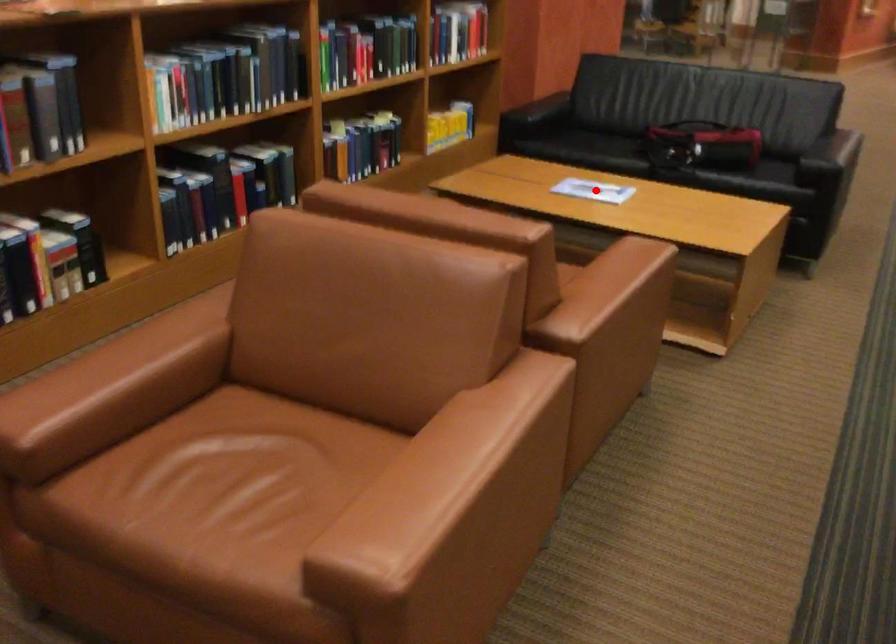
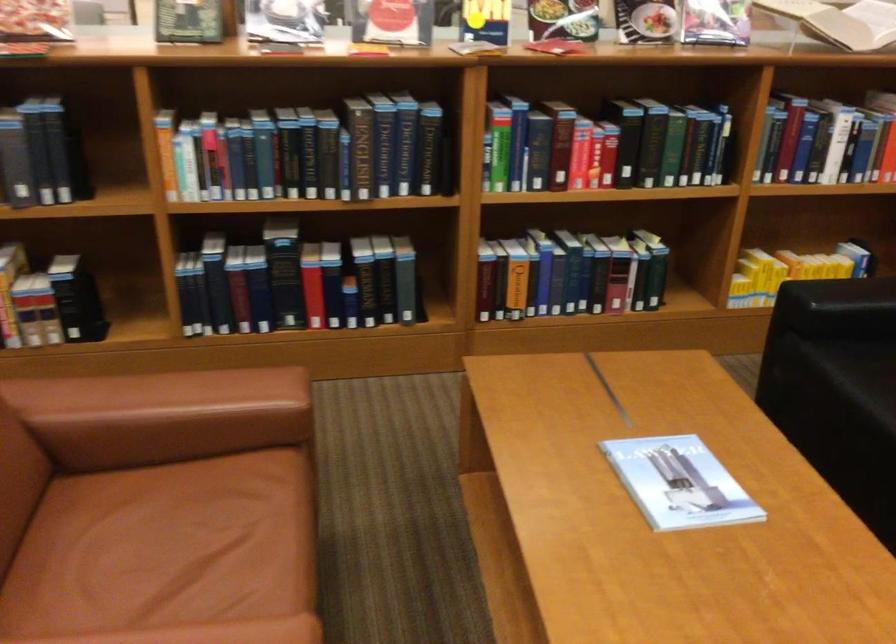
Question: I am providing you with two images of the same scene from different viewpoints. Given a red point in image1, look at the same physical point in image2. Is it:

Choices:
 (A) Closer to the viewpoint
 (B) Farther from the viewpoint

Answer: (A)